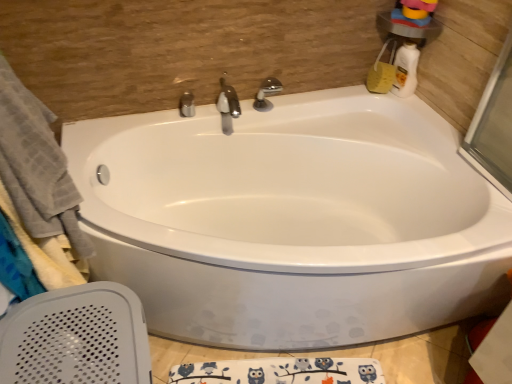
Where is `polished chrome faucet at center, the 1th tap positioned from the left`? polished chrome faucet at center, the 1th tap positioned from the left is located at coordinates (187, 104).

Image resolution: width=512 pixels, height=384 pixels. Identify the location of white glossy bathtub at center. (292, 220).

Find the location of a particular element. The image size is (512, 384). satin nickel faucet at center, positioned as the second tap in right-to-left order is located at coordinates (227, 106).

Where is `polished chrome faucet at center, the 1th tap positioned from the left`? This screenshot has height=384, width=512. polished chrome faucet at center, the 1th tap positioned from the left is located at coordinates (187, 104).

Is white glossy bottle at upper right wider or thinner than white glossy bathtub at center?

Considering their sizes, white glossy bottle at upper right looks slimmer than white glossy bathtub at center.

Considering the sizes of objects white glossy bottle at upper right and white glossy bathtub at center in the image provided, who is shorter, white glossy bottle at upper right or white glossy bathtub at center?

Standing shorter between the two is white glossy bottle at upper right.

Relative to white glossy bathtub at center, is white glossy bottle at upper right in front or behind?

In the image, white glossy bottle at upper right appears behind white glossy bathtub at center.

From a real-world perspective, between white glossy bottle at upper right and white glossy bathtub at center, who is vertically lower?

white glossy bathtub at center, from a real-world perspective.

From the image's perspective, which is above, white glossy bottle at upper right or gray cotton towel at left?

white glossy bottle at upper right appears higher in the image.

Considering the relative sizes of white glossy bottle at upper right and gray cotton towel at left in the image provided, is white glossy bottle at upper right bigger than gray cotton towel at left?

No.

How many degrees apart are the facing directions of white glossy bottle at upper right and gray cotton towel at left?

90.8 degrees separate the facing orientations of white glossy bottle at upper right and gray cotton towel at left.

Is white glossy bottle at upper right in contact with gray cotton towel at left?

No, white glossy bottle at upper right is not beside gray cotton towel at left.

From the image's perspective, is polished chrome faucet at upper center, acting as the 1th tap starting from the right, on top of gray cotton towel at left?

Yes.

Does point (267, 92) lie behind point (69, 264)?

Yes, it is behind point (69, 264).

Are polished chrome faucet at upper center, which is the 3th tap from left to right, and gray cotton towel at left far apart?

Yes, polished chrome faucet at upper center, which is the 3th tap from left to right, is far from gray cotton towel at left.

From a real-world perspective, is white glossy bathtub at center on top of polished chrome faucet at upper center, which is the 3th tap from left to right?

No, from a real-world perspective, white glossy bathtub at center is not above polished chrome faucet at upper center, which is the 3th tap from left to right.

How many degrees apart are the facing directions of white glossy bathtub at center and polished chrome faucet at upper center, acting as the 1th tap starting from the right?

There is a 0.524-degree angle between the facing directions of white glossy bathtub at center and polished chrome faucet at upper center, acting as the 1th tap starting from the right.

From the image's perspective, does white glossy bathtub at center appear lower than polished chrome faucet at upper center, which is the 3th tap from left to right?

Yes.

Between white glossy bathtub at center and polished chrome faucet at upper center, acting as the 1th tap starting from the right, which one is positioned in front?

white glossy bathtub at center is closer to the camera.

In the image, is polished chrome faucet at upper center, which is the 3th tap from left to right, positioned in front of or behind polished chrome faucet at center, the 1th tap positioned from the left?

polished chrome faucet at upper center, which is the 3th tap from left to right, is positioned closer to the viewer than polished chrome faucet at center, the 1th tap positioned from the left.

Is polished chrome faucet at upper center, which is the 3th tap from left to right, looking in the opposite direction of polished chrome faucet at center, the 1th tap positioned from the left?

No, polished chrome faucet at center, the 1th tap positioned from the left, is not at the back of polished chrome faucet at upper center, which is the 3th tap from left to right.

Which is closer to the camera, [257,98] or [185,104]?

The point [185,104] is closer to the camera.

Does polished chrome faucet at upper center, acting as the 1th tap starting from the right, appear on the right side of polished chrome faucet at center, acting as the third tap starting from the right?

Correct, you'll find polished chrome faucet at upper center, acting as the 1th tap starting from the right, to the right of polished chrome faucet at center, acting as the third tap starting from the right.

In the image, is polished chrome faucet at center, the 1th tap positioned from the left, on the left side or the right side of white glossy bottle at upper right?

polished chrome faucet at center, the 1th tap positioned from the left, is positioned on white glossy bottle at upper right's left side.

Which is in front, point (183, 97) or point (395, 93)?

Positioned in front is point (183, 97).

From the image's perspective, which object appears higher, polished chrome faucet at center, the 1th tap positioned from the left, or white glossy bottle at upper right?

From the image's view, white glossy bottle at upper right is above.

Which of these two, polished chrome faucet at center, acting as the third tap starting from the right, or white glossy bottle at upper right, is bigger?

Bigger between the two is white glossy bottle at upper right.

Relative to satin nickel faucet at center, the second tap in the left-to-right sequence, is white glossy bathtub at center in front or behind?

In the image, white glossy bathtub at center appears in front of satin nickel faucet at center, the second tap in the left-to-right sequence.

Locate an element on the screen. The height and width of the screenshot is (384, 512). bathtub located on the right of satin nickel faucet at center, positioned as the second tap in right-to-left order is located at coordinates (292, 220).

From a real-world perspective, is white glossy bathtub at center physically below satin nickel faucet at center, the second tap in the left-to-right sequence?

Yes, from a real-world perspective, white glossy bathtub at center is below satin nickel faucet at center, the second tap in the left-to-right sequence.

Which object is thinner, white glossy bathtub at center or satin nickel faucet at center, positioned as the second tap in right-to-left order?

satin nickel faucet at center, positioned as the second tap in right-to-left order.

This screenshot has height=384, width=512. What are the coordinates of `bathtub on the left of white glossy bottle at upper right` in the screenshot? It's located at (292, 220).

Locate an element on the screen. bath towel above the white glossy bottle at upper right (from a real-world perspective) is located at coordinates (38, 180).

Estimate the real-world distances between objects in this image. Which object is closer to polished chrome faucet at center, the 1th tap positioned from the left, white glossy bottle at upper right or white glossy bathtub at center?

Among the two, white glossy bathtub at center is located nearer to polished chrome faucet at center, the 1th tap positioned from the left.

When comparing their distances from satin nickel faucet at center, the second tap in the left-to-right sequence, does gray cotton towel at left or white glossy bottle at upper right seem closer?

white glossy bottle at upper right lies closer to satin nickel faucet at center, the second tap in the left-to-right sequence, than the other object.

Based on their spatial positions, is white glossy bottle at upper right or polished chrome faucet at upper center, which is the 3th tap from left to right, closer to gray cotton towel at left?

polished chrome faucet at upper center, which is the 3th tap from left to right.

From the picture: Which object lies further to the anchor point satin nickel faucet at center, the second tap in the left-to-right sequence, white glossy bottle at upper right or gray cotton towel at left?

gray cotton towel at left lies further to satin nickel faucet at center, the second tap in the left-to-right sequence, than the other object.

Considering their positions, is white glossy bathtub at center positioned further to gray cotton towel at left than polished chrome faucet at upper center, which is the 3th tap from left to right?

polished chrome faucet at upper center, which is the 3th tap from left to right, is positioned further to the anchor gray cotton towel at left.

Considering their positions, is polished chrome faucet at upper center, acting as the 1th tap starting from the right, positioned closer to gray cotton towel at left than satin nickel faucet at center, positioned as the second tap in right-to-left order?

satin nickel faucet at center, positioned as the second tap in right-to-left order, lies closer to gray cotton towel at left than the other object.

Looking at the image, which one is located closer to white glossy bottle at upper right, white glossy bathtub at center or gray cotton towel at left?

white glossy bathtub at center.

Considering their positions, is gray cotton towel at left positioned further to polished chrome faucet at upper center, acting as the 1th tap starting from the right, than white glossy bathtub at center?

The object further to polished chrome faucet at upper center, acting as the 1th tap starting from the right, is gray cotton towel at left.

Where is `bathtub located between gray cotton towel at left and polished chrome faucet at center, acting as the third tap starting from the right, in the depth direction`? The width and height of the screenshot is (512, 384). bathtub located between gray cotton towel at left and polished chrome faucet at center, acting as the third tap starting from the right, in the depth direction is located at coordinates (292, 220).

Image resolution: width=512 pixels, height=384 pixels. What are the coordinates of `tap between white glossy bathtub at center and polished chrome faucet at upper center, which is the 3th tap from left to right, from front to back` in the screenshot? It's located at (227, 106).

This screenshot has width=512, height=384. Identify the location of bathtub between gray cotton towel at left and satin nickel faucet at center, the second tap in the left-to-right sequence, in the front-back direction. (292, 220).

This screenshot has width=512, height=384. Identify the location of tap located between gray cotton towel at left and polished chrome faucet at upper center, which is the 3th tap from left to right, in the depth direction. (227, 106).